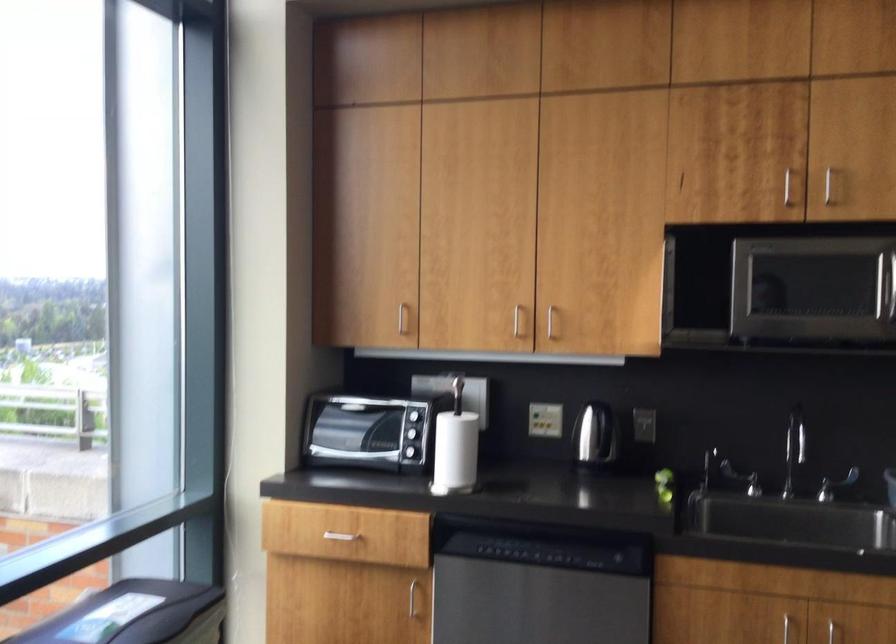
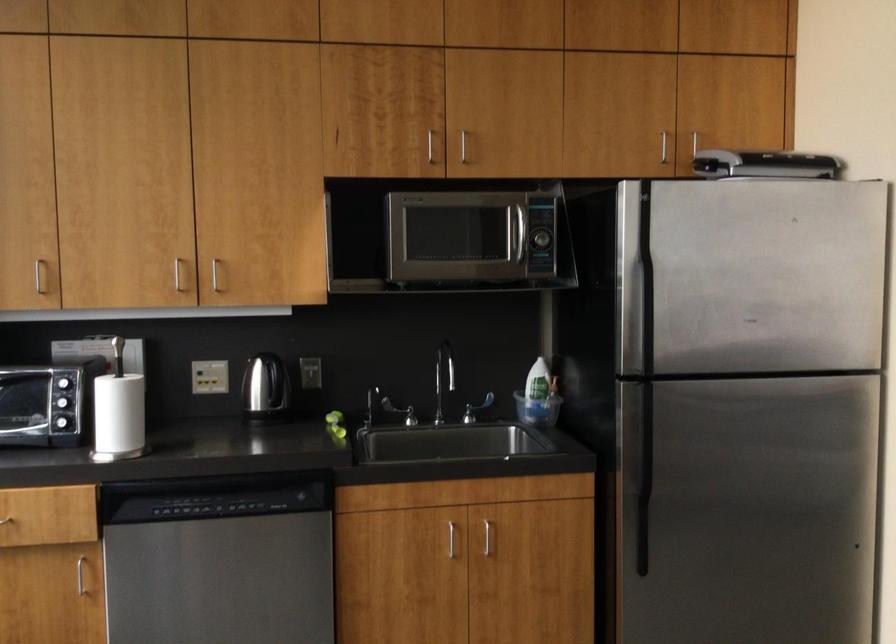
Find the pixel in the second image that matches point (824, 182) in the first image.

(462, 146)